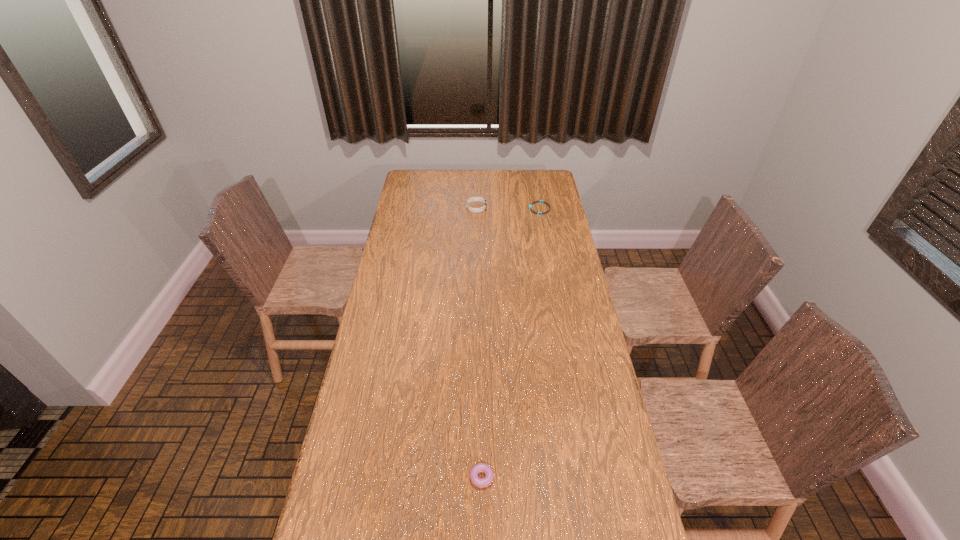
Where is `free space located on the buckle of the shortest object`? The image size is (960, 540). free space located on the buckle of the shortest object is located at coordinates (465, 208).

Identify the location of object present at the right edge. This screenshot has height=540, width=960. (540, 201).

Identify the location of free spot at the far edge of the desktop. (505, 173).

Locate an element on the screen. The height and width of the screenshot is (540, 960). blank space at the left edge is located at coordinates (400, 194).

In the image, there is a desktop. Identify the location of vacant space at the right edge. (554, 240).

Where is `vacant space at the far left corner of the desktop`? vacant space at the far left corner of the desktop is located at coordinates (411, 173).

I want to click on vacant space at the far right corner of the desktop, so click(545, 187).

Locate an element on the screen. Image resolution: width=960 pixels, height=540 pixels. free space between the second shortest object and the rightmost object is located at coordinates (511, 342).

Locate an element on the screen. The width and height of the screenshot is (960, 540). vacant space that's between the doughnut and the tallest object is located at coordinates (479, 341).

I want to click on empty space between the left wristband and the nearest object, so click(x=479, y=341).